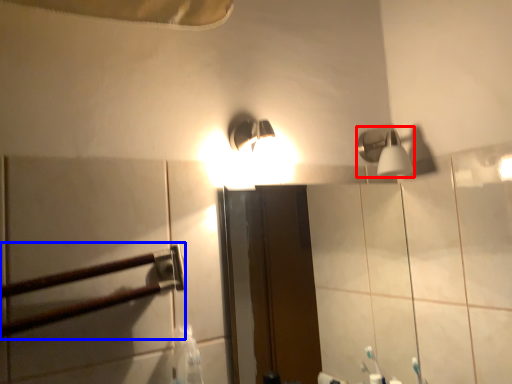
Question: Which point is closer to the camera, shower (highlighted by a red box) or rail (highlighted by a blue box)?

Choices:
 (A) shower
 (B) rail

Answer: (B)